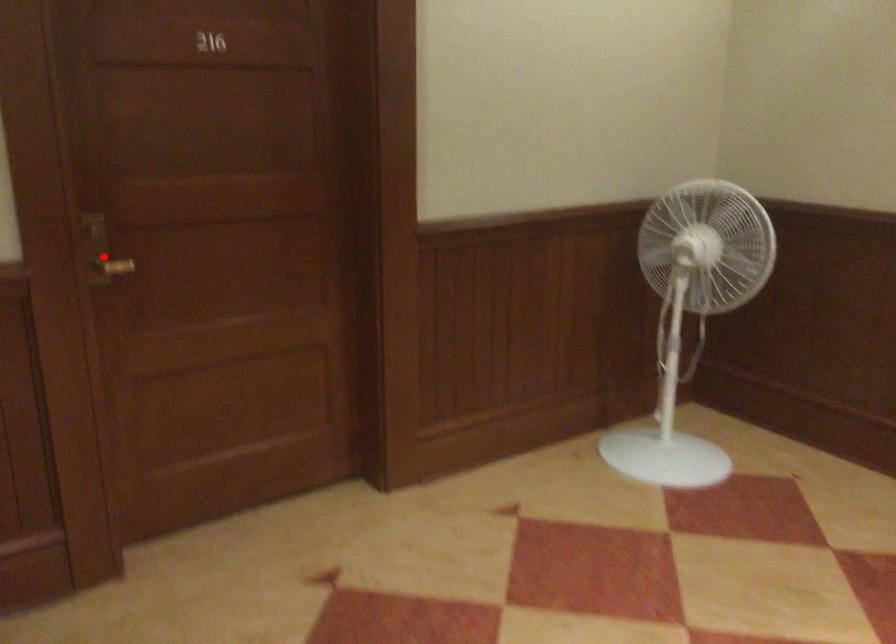
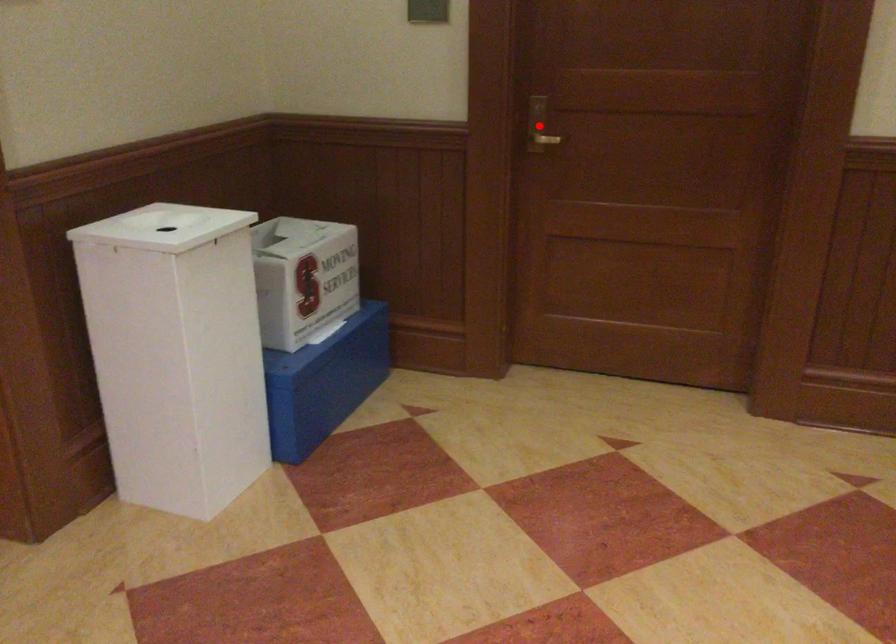
I am providing you with two images of the same scene from different viewpoints. A red point is marked on the first image and another point is marked on the second image. Is the marked point in image1 the same physical position as the marked point in image2?

Yes